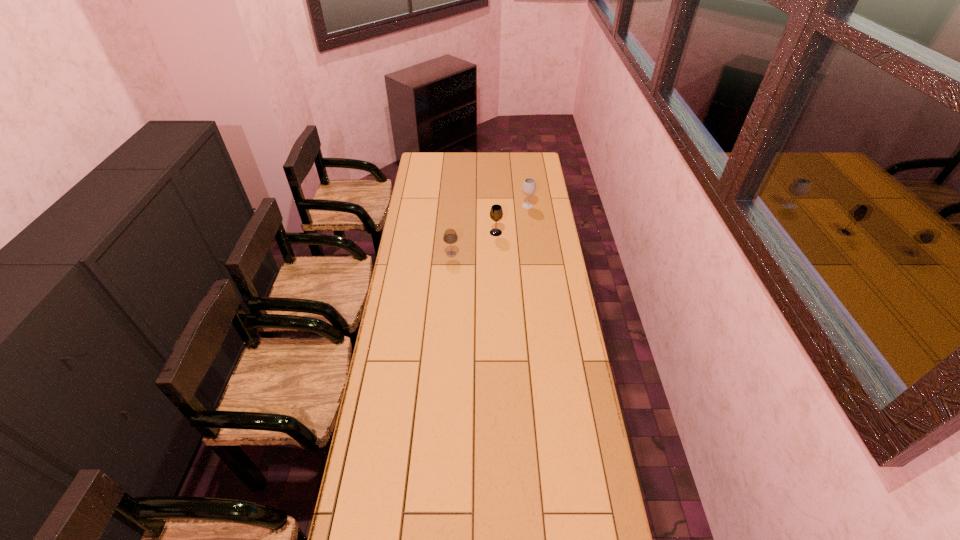
Choose which object is the second nearest neighbor to the rightmost wineglass. Please provide its 2D coordinates. Your answer should be formatted as a tuple, i.e. [(x, y)], where the tuple contains the x and y coordinates of a point satisfying the conditions above.

[(450, 236)]

You are a GUI agent. You are given a task and a screenshot of the screen. Output one action in this format:
    pyautogui.click(x=<x>, y=<y>)
    Task: Click on the object identified as the closest to the farthest object
    
    Given the screenshot: What is the action you would take?
    pyautogui.click(x=496, y=213)

Locate which wineglass ranks in proximity to the second object from left to right. Please provide its 2D coordinates. Your answer should be formatted as a tuple, i.e. [(x, y)], where the tuple contains the x and y coordinates of a point satisfying the conditions above.

[(450, 236)]

Identify which wineglass is the second nearest to the second nearest object. Please provide its 2D coordinates. Your answer should be formatted as a tuple, i.e. [(x, y)], where the tuple contains the x and y coordinates of a point satisfying the conditions above.

[(529, 186)]